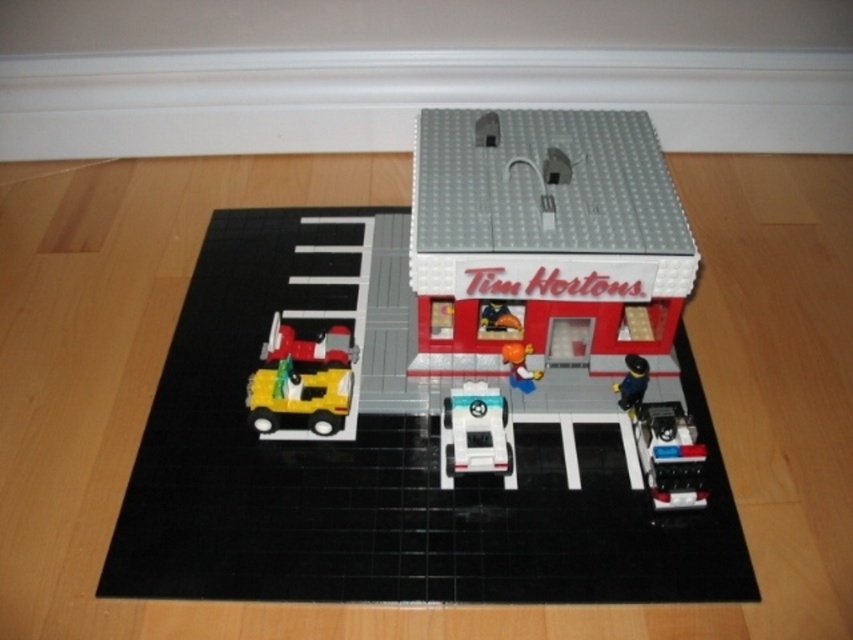
Question: Is black rubber mat at center above shiny yellow truck at lower left?

Choices:
 (A) yes
 (B) no

Answer: (B)

Question: Which of the following is the closest to the observer?

Choices:
 (A) shiny silver car at lower right
 (B) black rubber mat at center
 (C) smooth plastic tim hortons building at center
 (D) white plastic car at center

Answer: (B)

Question: Which of the following is the closest to the observer?

Choices:
 (A) shiny red car at center
 (B) smooth plastic tim hortons building at center

Answer: (B)

Question: Which object appears farthest from the camera in this image?

Choices:
 (A) shiny yellow truck at lower left
 (B) smooth plastic tim hortons building at center
 (C) orange matte figure at center

Answer: (C)

Question: Does smooth plastic tim hortons building at center appear on the right side of shiny silver car at lower right?

Choices:
 (A) no
 (B) yes

Answer: (A)

Question: Is black rubber mat at center closer to the viewer compared to shiny silver car at lower right?

Choices:
 (A) no
 (B) yes

Answer: (B)